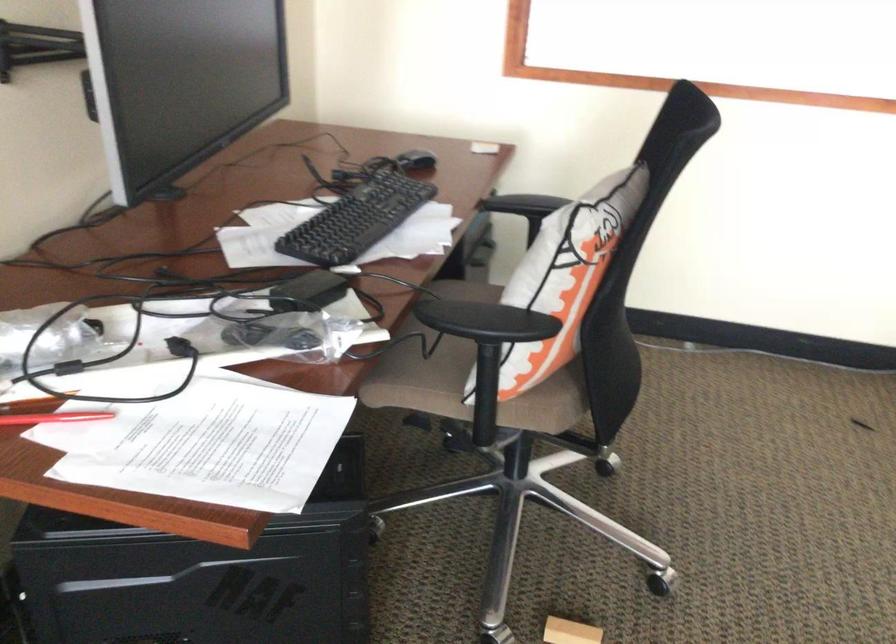
Where would you lift the decorative throw pillow? Please return your answer as a coordinate pair (x, y).

(564, 277)